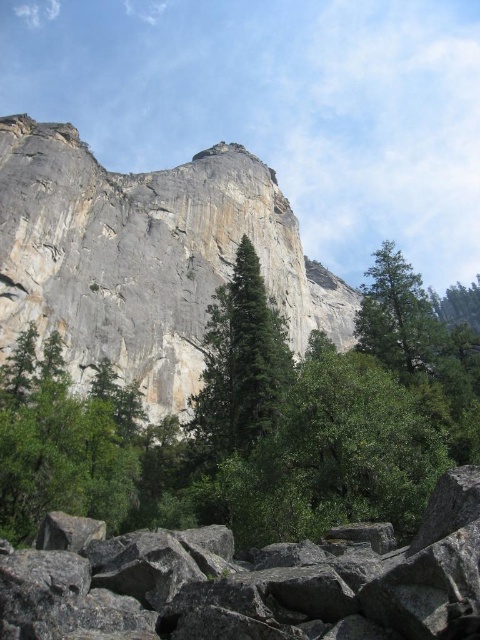
Is green matte tree at center above green textured tree at lower right?

No.

Between green matte tree at center and green textured tree at lower right, which one appears on the left side from the viewer's perspective?

green matte tree at center is more to the left.

Between point (245, 413) and point (428, 362), which one is positioned behind?

Point (428, 362)

The width and height of the screenshot is (480, 640). Find the location of `green matte tree at center`. green matte tree at center is located at coordinates (240, 365).

Does point (173, 188) come in front of point (275, 396)?

No.

Is gray rock formation at upper center further to the viewer compared to green matte tree at center?

Yes, gray rock formation at upper center is further from the viewer.

The height and width of the screenshot is (640, 480). Find the location of `gray rock formation at upper center`. gray rock formation at upper center is located at coordinates (145, 257).

Is gray rock formation at upper center below gray rough rocks at lower center?

Actually, gray rock formation at upper center is above gray rough rocks at lower center.

Does point (32, 298) come closer to viewer compared to point (247, 577)?

No, it is behind (247, 577).

Locate an element on the screen. This screenshot has width=480, height=640. gray rock formation at upper center is located at coordinates (145, 257).